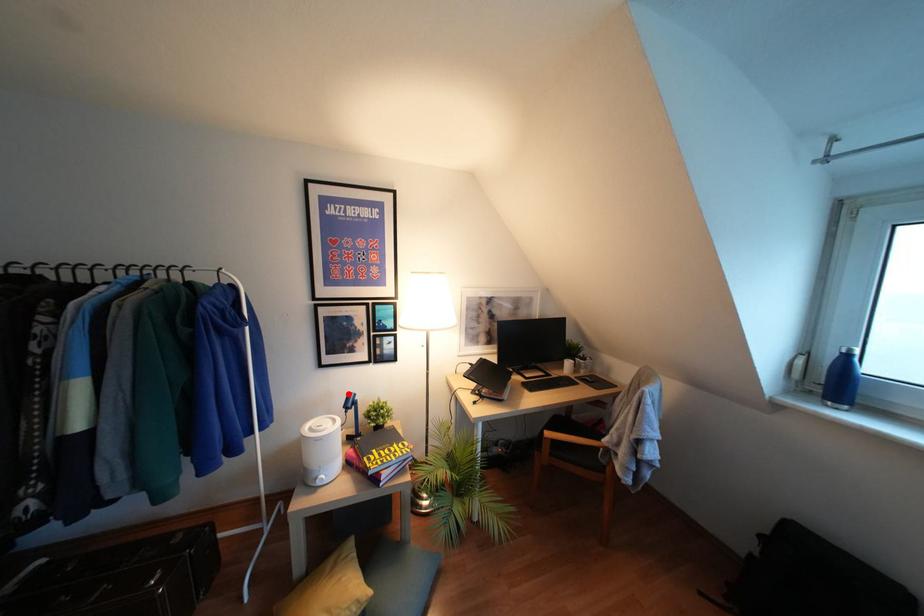
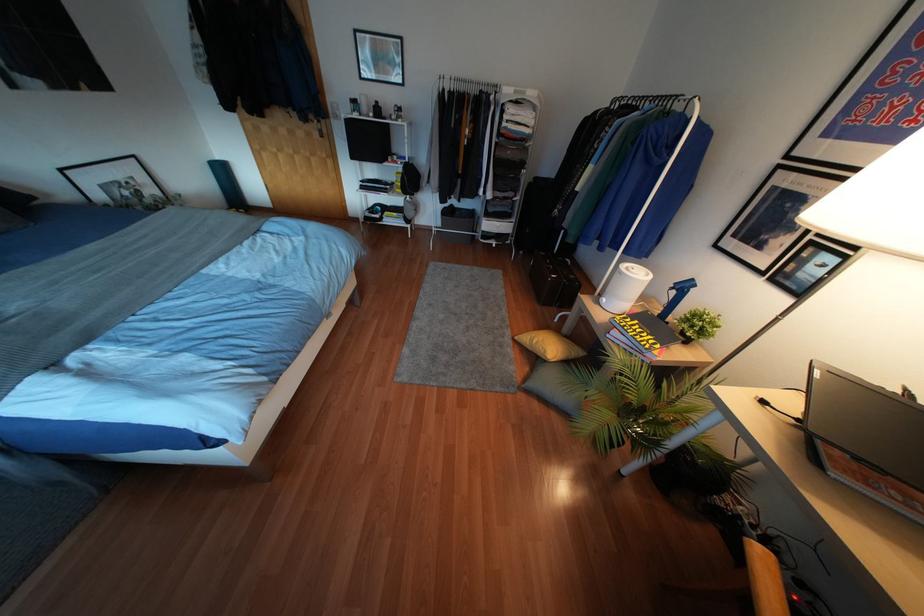
Find the pixel in the second image that matches the highlighted location in the first image.

(690, 280)